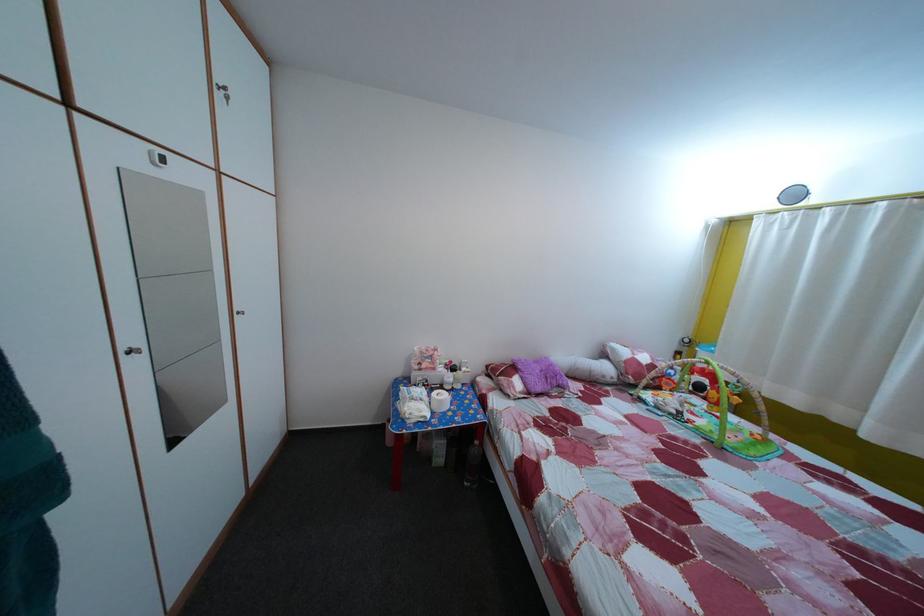
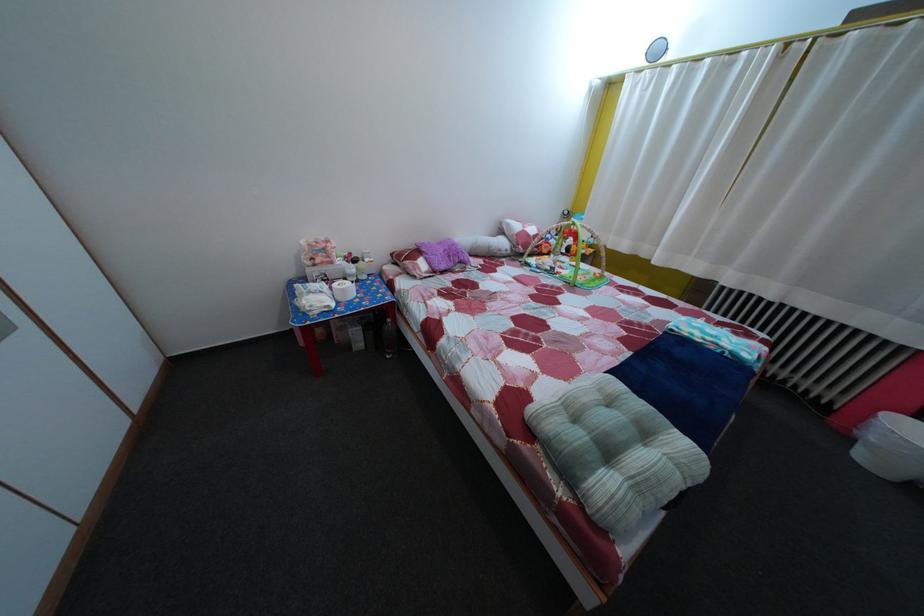
In the second image, find the point that corresponds to [545,370] in the first image.

(450, 252)